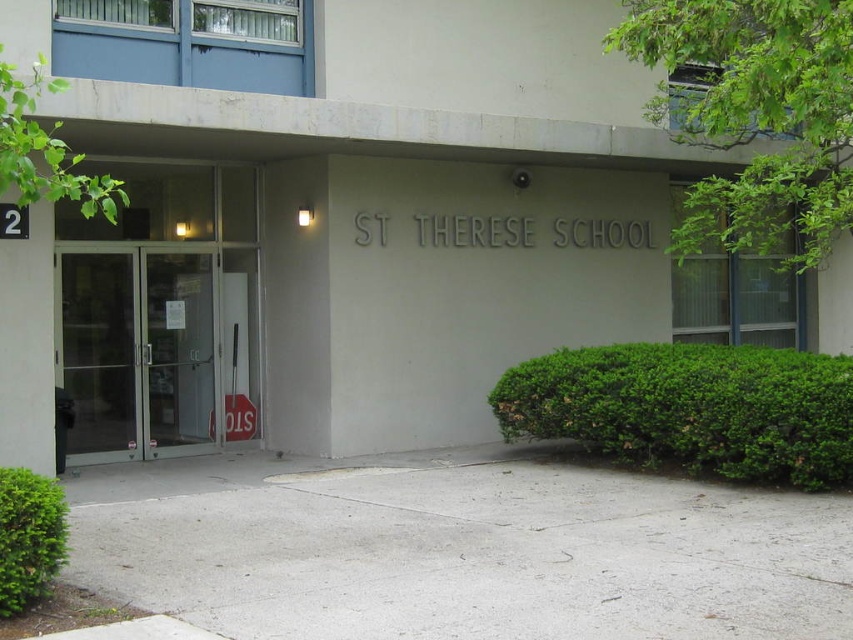
You are a parent trying to enter St. Therese School for a meeting. You see the transparent glass doors at center and the clear glass window at upper right. Which one is more likely to allow you to see inside the building?

Both the transparent glass doors at center and the clear glass window at upper right are made of glass, but the transparent glass doors at center are smaller than the clear glass window at upper right. Since doors are typically openable, the transparent glass doors at center would allow you to enter and see inside, while the clear glass window at upper right might only provide a view but not access.

You are a student arriving at St. Therese School and need to check the posted notices. The clear glass window at upper right and the green leafy tree at upper left are both visible from your vantage point. Which object is wider in terms of their horizontal span?

The clear glass window at upper right might be wider than green leafy tree at upper left according to the description provided.

You are a visitor approaching the entrance of St Therese School. You notice the clear glass window at upper right and the green leafy tree at upper left. Which one appears bigger in size?

The clear glass window at upper right has a larger size compared to the green leafy tree at upper left, so the clear glass window at upper right appears bigger in size.